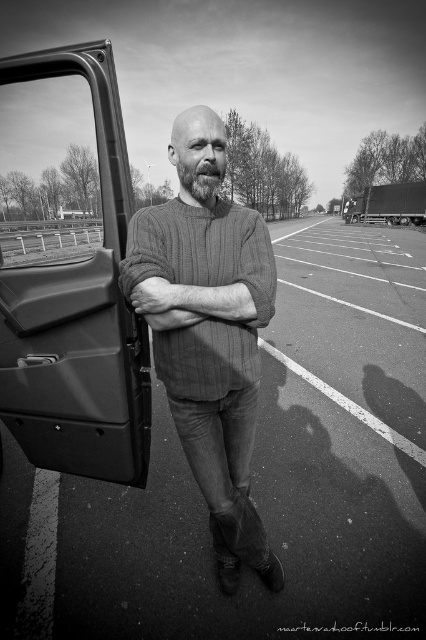
What do you see at coordinates (210, 353) in the screenshot? This screenshot has width=426, height=640. I see `knitted sweater at center` at bounding box center [210, 353].

Which is behind, point (218, 246) or point (394, 188)?

The point (394, 188) is behind.

Which is behind, point (160, 340) or point (397, 202)?

Positioned behind is point (397, 202).

At what (x,y) coordinates should I click in order to perform the action: click on knitted sweater at center. Please return your answer as a coordinate pair (x, y). Looking at the image, I should click on (210, 353).

Who is positioned more to the left, smooth asphalt parking lot at center or bearded at center?

bearded at center

Can you confirm if smooth asphalt parking lot at center is shorter than bearded at center?

No, smooth asphalt parking lot at center is not shorter than bearded at center.

Is point (293, 588) farther from viewer compared to point (196, 189)?

Yes.

Locate an element on the screen. The height and width of the screenshot is (640, 426). smooth asphalt parking lot at center is located at coordinates (256, 476).

Who is higher up, matte plastic car door at left or bearded at center?

matte plastic car door at left

Is point (37, 72) closer to viewer compared to point (195, 193)?

Yes, point (37, 72) is closer to viewer.

The image size is (426, 640). I want to click on matte plastic car door at left, so click(69, 269).